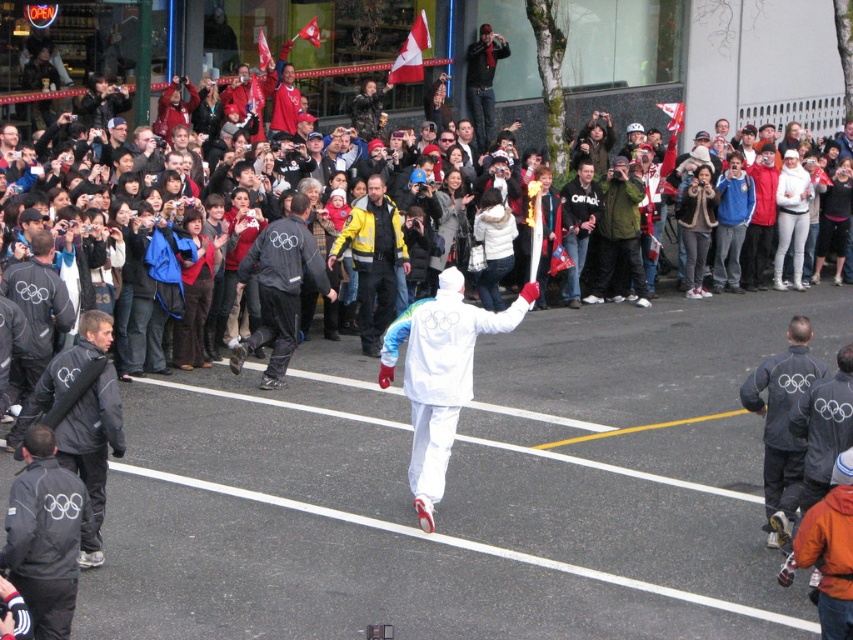
Question: Is white matte olympic uniform at center further to the viewer compared to yellow matte jacket at center?

Choices:
 (A) yes
 (B) no

Answer: (B)

Question: Which point appears farthest from the camera in this image?

Choices:
 (A) (32, 536)
 (B) (456, 273)

Answer: (B)

Question: Does white matte olympic uniform at center have a smaller size compared to yellow matte jacket at center?

Choices:
 (A) no
 (B) yes

Answer: (A)

Question: Is black fabric jacket at left above dark blue jacket at upper center?

Choices:
 (A) yes
 (B) no

Answer: (B)

Question: Among these points, which one is nearest to the camera?

Choices:
 (A) (358, 275)
 (B) (664, 112)

Answer: (A)

Question: Which point appears closest to the camera in this image?

Choices:
 (A) (306, 269)
 (B) (111, 420)
 (C) (421, 317)

Answer: (B)